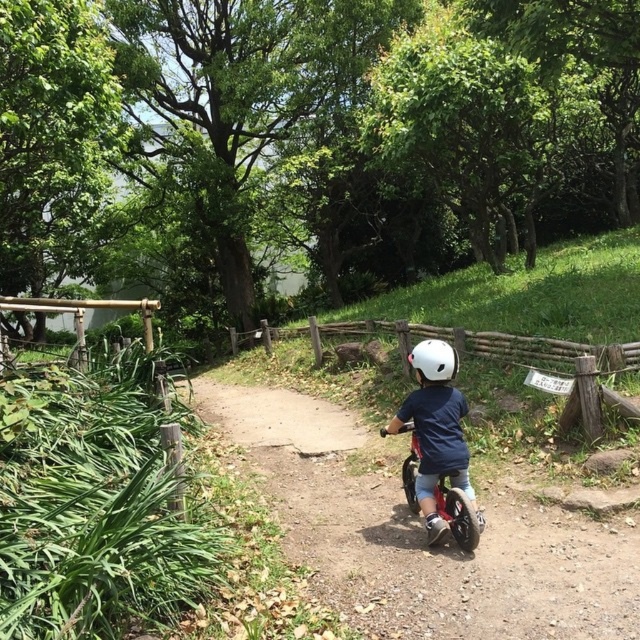
You are standing at the starting point of the dirt path and want to reach the end of the path. Which point, point (476, 595) or point (458, 516), is closer to you as you begin your journey?

Point (476, 595) is closer to the viewer than point (458, 516), so you should head towards point (476, 595) first.

You are a photographer setting up a tripod to capture the orange matte bicycle at center and the white matte helmet at center. Which object should you focus on first if you want to ensure both are in frame without moving the tripod?

You should focus on the orange matte bicycle at center first since it is larger than the white matte helmet at center, making it easier to center the tripod and frame both objects.